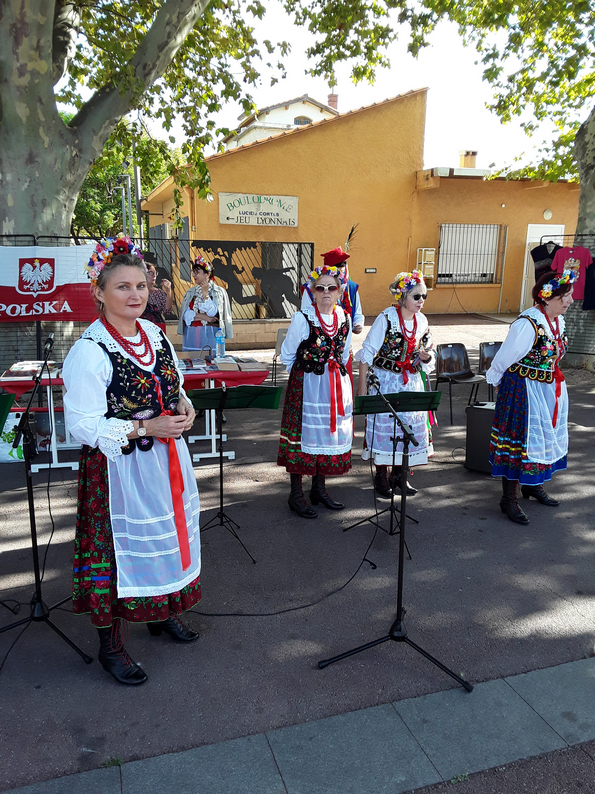
Locate an element on the screen. stand is located at coordinates pyautogui.click(x=397, y=615).